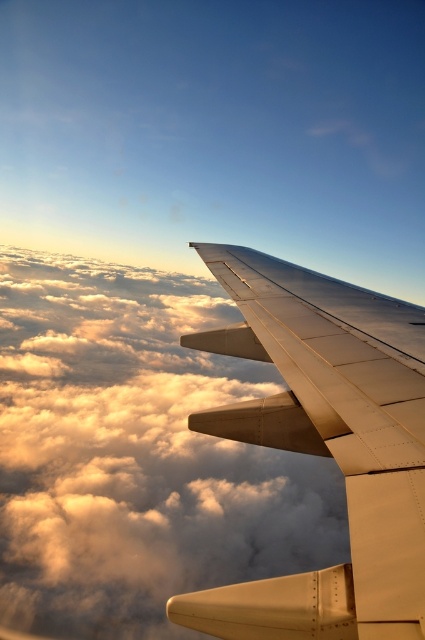
You are a passenger sitting at the window seat of an aircraft. You notice a specific point at coordinates point [136,454]. Based on the scene, where is this point located?

The point [136,454] is located on cloudy white at upper center.

Consider the image. You are a pilot looking at the view from the cockpit window. You notice the cloudy white at upper center and the metallic silver wing at upper center. Which object is positioned higher in the image?

The cloudy white at upper center is much taller than the metallic silver wing at upper center, so the cloudy white at upper center is positioned higher in the image.